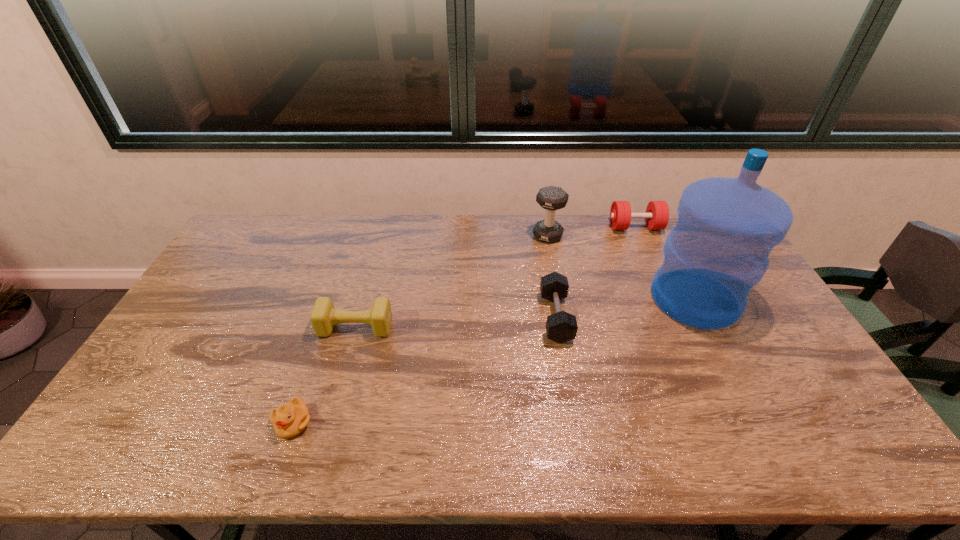
Identify the location of object identified as the closest to the nearest object. (324, 316).

At what (x,y) coordinates should I click in order to perform the action: click on object that stands as the fifth closest to the rightmost dumbbell. Please return your answer as a coordinate pair (x, y). This screenshot has width=960, height=540. Looking at the image, I should click on (290, 419).

Locate which dumbbell is the third closest to the leftmost dumbbell. Please provide its 2D coordinates. Your answer should be formatted as a tuple, i.e. [(x, y)], where the tuple contains the x and y coordinates of a point satisfying the conditions above.

[(657, 212)]

Where is `the closest dumbbell to the tallest dumbbell`? the closest dumbbell to the tallest dumbbell is located at coordinates pyautogui.click(x=657, y=212).